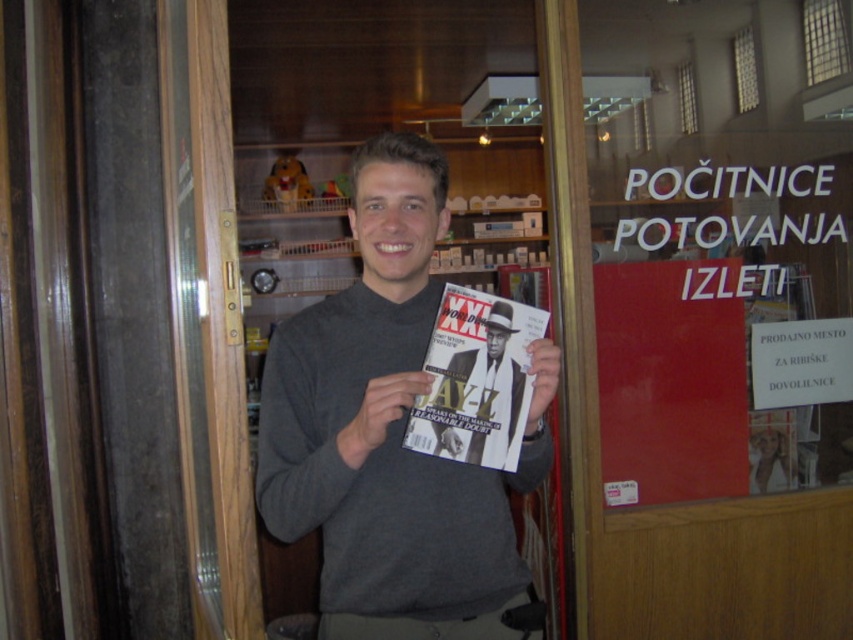
Question: Does gray sweater at center have a smaller size compared to red paper poster at right?

Choices:
 (A) yes
 (B) no

Answer: (A)

Question: Can you confirm if red paper poster at right is positioned above matte paper magazine at center?

Choices:
 (A) yes
 (B) no

Answer: (A)

Question: Can you confirm if gray sweater at center is thinner than red paper poster at right?

Choices:
 (A) yes
 (B) no

Answer: (A)

Question: Which point is closer to the camera?

Choices:
 (A) (460, 365)
 (B) (625, 436)

Answer: (A)

Question: Which of the following is the farthest from the observer?

Choices:
 (A) matte paper magazine at center
 (B) gray sweater at center

Answer: (A)

Question: Which object is the farthest from the matte paper magazine at center?

Choices:
 (A) gray sweater at center
 (B) red paper poster at right

Answer: (B)